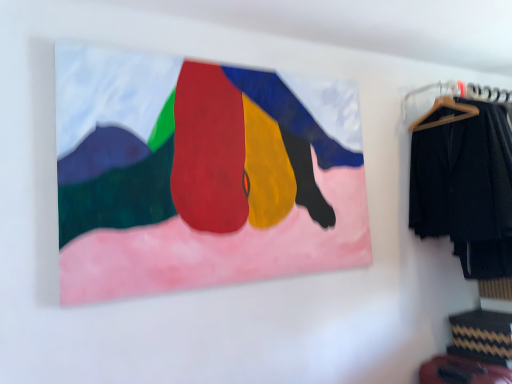
Question: Is matte canvas painting at upper center outside black fabric pants at right?

Choices:
 (A) no
 (B) yes

Answer: (B)

Question: Is matte canvas painting at upper center facing away from black fabric pants at right?

Choices:
 (A) no
 (B) yes

Answer: (A)

Question: Is matte canvas painting at upper center aimed at black fabric pants at right?

Choices:
 (A) yes
 (B) no

Answer: (B)

Question: From the image's perspective, is matte canvas painting at upper center beneath black fabric pants at right?

Choices:
 (A) no
 (B) yes

Answer: (A)

Question: Is matte canvas painting at upper center beside black fabric pants at right?

Choices:
 (A) no
 (B) yes

Answer: (A)

Question: Is matte canvas painting at upper center behind black fabric pants at right?

Choices:
 (A) yes
 (B) no

Answer: (B)

Question: Is the position of matte canvas painting at upper center less distant than that of wooden hanger at upper right?

Choices:
 (A) yes
 (B) no

Answer: (A)

Question: Is matte canvas painting at upper center not near wooden hanger at upper right?

Choices:
 (A) yes
 (B) no

Answer: (A)

Question: Considering the relative sizes of matte canvas painting at upper center and wooden hanger at upper right in the image provided, is matte canvas painting at upper center thinner than wooden hanger at upper right?

Choices:
 (A) yes
 (B) no

Answer: (A)

Question: From the image's perspective, is matte canvas painting at upper center above wooden hanger at upper right?

Choices:
 (A) no
 (B) yes

Answer: (A)

Question: Can you confirm if matte canvas painting at upper center is smaller than wooden hanger at upper right?

Choices:
 (A) yes
 (B) no

Answer: (B)

Question: Can you confirm if matte canvas painting at upper center is shorter than wooden hanger at upper right?

Choices:
 (A) no
 (B) yes

Answer: (A)

Question: Is black fabric pants at right taller than wooden hanger at upper right?

Choices:
 (A) yes
 (B) no

Answer: (A)